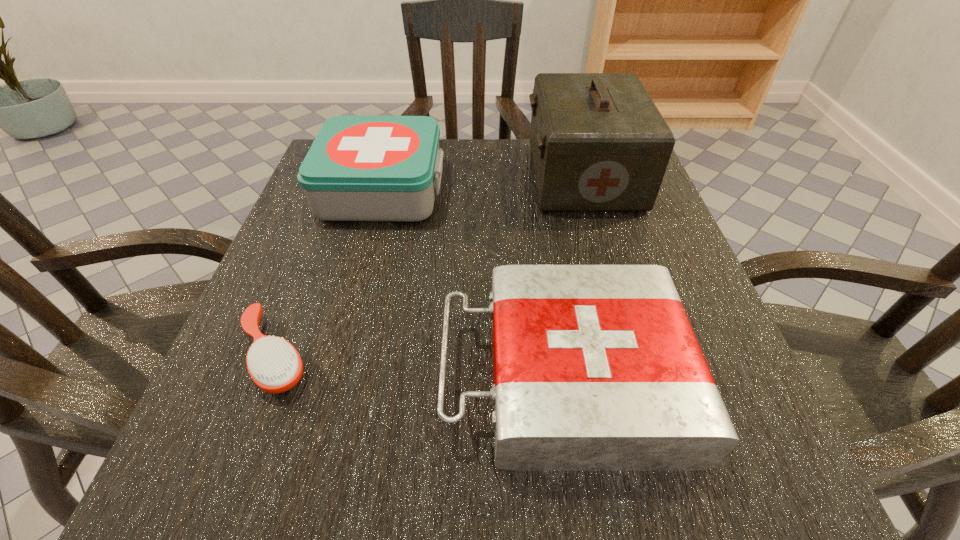
Locate an element on the screen. The width and height of the screenshot is (960, 540). the tallest object is located at coordinates (599, 143).

I want to click on the leftmost first-aid kit, so click(359, 168).

At what (x,y) coordinates should I click in order to perform the action: click on the third tallest object. Please return your answer as a coordinate pair (x, y). Looking at the image, I should click on (595, 367).

This screenshot has width=960, height=540. Find the location of `the shortest first-aid kit`. the shortest first-aid kit is located at coordinates (595, 367).

You are a GUI agent. You are given a task and a screenshot of the screen. Output one action in this format:
    pyautogui.click(x=<x>, y=<y>)
    Task: Click on the shortest object
    
    Given the screenshot: What is the action you would take?
    pyautogui.click(x=275, y=366)

What are the coordinates of `vacant area situated 0.110m on the left of the tallest first-aid kit` in the screenshot? It's located at (479, 176).

Find the location of `vacant area situated 0.120m on the right of the leftmost first-aid kit`. vacant area situated 0.120m on the right of the leftmost first-aid kit is located at coordinates click(500, 189).

The height and width of the screenshot is (540, 960). Identify the location of vacant space located 0.230m on the front side of the second shortest object. (283, 376).

Locate an element on the screen. This screenshot has width=960, height=540. free location located 0.300m on the front side of the second shortest object is located at coordinates (234, 376).

Find the location of `free space located on the front side of the second shortest object`. free space located on the front side of the second shortest object is located at coordinates (367, 376).